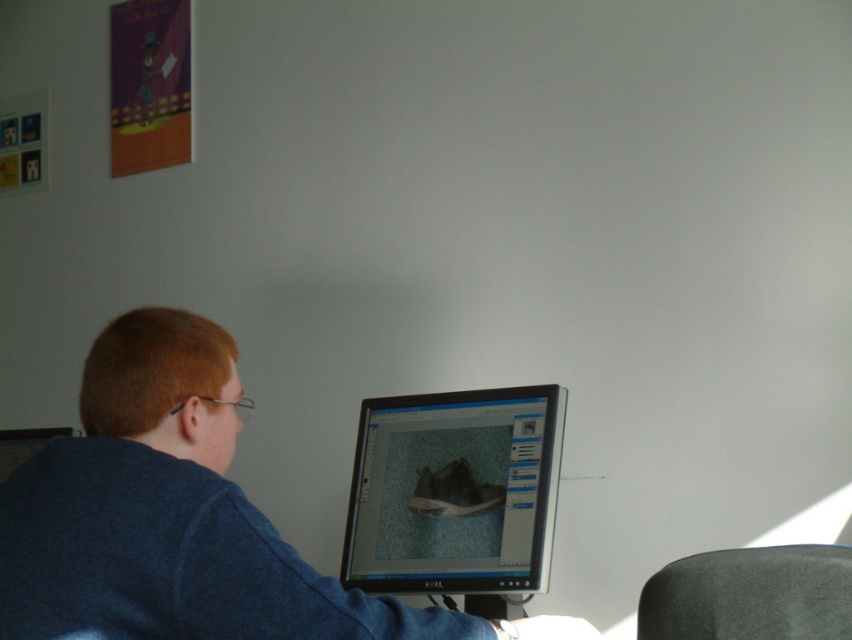
You are a tailor who needs to measure the blue cotton shirt at center for alterations. You also see the satin black monitor at center. Which object is bigger in size?

The blue cotton shirt at center has a larger size compared to the satin black monitor at center, so the blue cotton shirt at center is bigger.

You are a delivery robot with a height of 1.6 meters. You need to deliver a package to the desk where the person is working. The desk has a satin black monitor at center. Can you safely place the package on the desk without hitting your head?

The distance between the satin black monitor at center and the camera is 1.63 meters. Since the robot is 1.6 meters tall, there is enough clearance as 1.63 meters is greater than the robot height of 1.6 meters. Therefore, the robot can safely place the package on the desk.